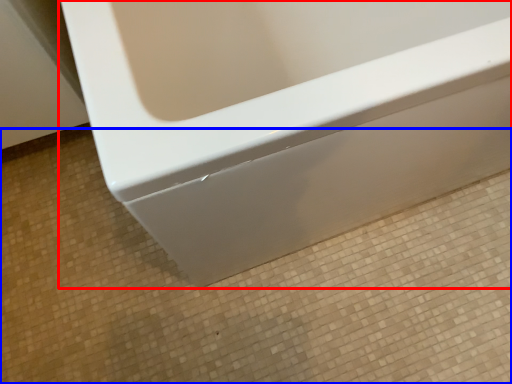
Question: Which object appears closest to the camera in this image, bathtub (highlighted by a red box) or ceramic tile (highlighted by a blue box)?

Choices:
 (A) bathtub
 (B) ceramic tile

Answer: (A)